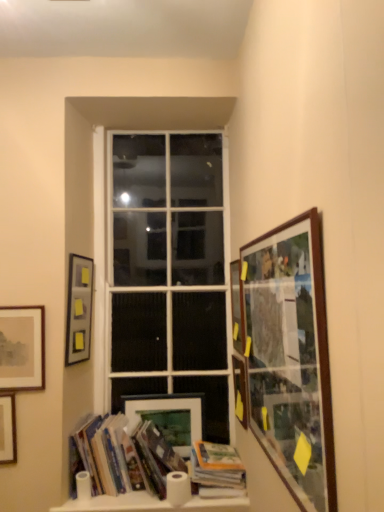
The height and width of the screenshot is (512, 384). What do you see at coordinates (140, 469) in the screenshot? I see `hardcover books at lower left, which is the first book from left to right` at bounding box center [140, 469].

This screenshot has width=384, height=512. What are the coordinates of `white glass window at center` in the screenshot? It's located at (166, 273).

This screenshot has width=384, height=512. Find the location of `white matte toilet paper at lower center, which ranks as the 1th toilet paper in right-to-left order`. white matte toilet paper at lower center, which ranks as the 1th toilet paper in right-to-left order is located at coordinates (178, 488).

Find the location of `matte black picture frame at lower left, acting as the third picture frame starting from the left`. matte black picture frame at lower left, acting as the third picture frame starting from the left is located at coordinates (79, 309).

Measure the distance between point (194, 477) and camera.

Point (194, 477) is 6.38 feet away from camera.

Find the location of `matte glass picture frame at right, marked as the sixth picture frame in a left-to-right arrangement`. matte glass picture frame at right, marked as the sixth picture frame in a left-to-right arrangement is located at coordinates (240, 389).

Is matte brown picture frame at left, which is counted as the 2th picture frame, starting from the left, oriented towards matte black picture frame at lower left, which ranks as the 5th picture frame in right-to-left order?

No, matte brown picture frame at left, which is counted as the 2th picture frame, starting from the left, does not turn towards matte black picture frame at lower left, which ranks as the 5th picture frame in right-to-left order.

Are matte brown picture frame at left, which is counted as the 2th picture frame, starting from the left, and matte black picture frame at lower left, which ranks as the 5th picture frame in right-to-left order, located far from each other?

No, matte brown picture frame at left, which is counted as the 2th picture frame, starting from the left, is in close proximity to matte black picture frame at lower left, which ranks as the 5th picture frame in right-to-left order.

Is matte brown picture frame at left, which is counted as the 2th picture frame, starting from the left, positioned beyond the bounds of matte black picture frame at lower left, which ranks as the 5th picture frame in right-to-left order?

Yes.

Who is smaller, matte brown picture frame at left, acting as the 6th picture frame starting from the right, or matte black picture frame at lower left, acting as the third picture frame starting from the left?

→ matte brown picture frame at left, acting as the 6th picture frame starting from the right.

Based on the photo, can you confirm if wooden picture frame at right, placed as the third picture frame when sorted from right to left, is taller than hardcover book at lower center, the 2th book when ordered from left to right?

Indeed, wooden picture frame at right, placed as the third picture frame when sorted from right to left, has a greater height compared to hardcover book at lower center, the 2th book when ordered from left to right.

Which point is more forward, (241, 352) or (209, 495)?

Point (241, 352)

Is wooden picture frame at right, the fifth picture frame positioned from the left, not inside hardcover book at lower center, the 2th book when ordered from left to right?

That's correct, wooden picture frame at right, the fifth picture frame positioned from the left, is outside of hardcover book at lower center, the 2th book when ordered from left to right.

Can you confirm if wooden picture frame at right, the fifth picture frame positioned from the left, is positioned to the left of hardcover book at lower center, the first book when ordered from right to left?

No, wooden picture frame at right, the fifth picture frame positioned from the left, is not to the left of hardcover book at lower center, the first book when ordered from right to left.

From a real-world perspective, is wooden picture frame at lower left, acting as the 7th picture frame starting from the right, physically located above or below matte black picture frame at lower left, which ranks as the 5th picture frame in right-to-left order?

In terms of real-world spatial position, wooden picture frame at lower left, acting as the 7th picture frame starting from the right, is below matte black picture frame at lower left, which ranks as the 5th picture frame in right-to-left order.

Consider the image. Could you tell me if wooden picture frame at lower left, acting as the 7th picture frame starting from the right, is facing matte black picture frame at lower left, which ranks as the 5th picture frame in right-to-left order?

No, wooden picture frame at lower left, acting as the 7th picture frame starting from the right, is not aimed at matte black picture frame at lower left, which ranks as the 5th picture frame in right-to-left order.

Does wooden picture frame at lower left, the 1th picture frame from the left, lie in front of matte black picture frame at lower left, which ranks as the 5th picture frame in right-to-left order?

Yes, it is in front of matte black picture frame at lower left, which ranks as the 5th picture frame in right-to-left order.

From the image's perspective, which one is positioned lower, wooden picture frame at lower left, acting as the 7th picture frame starting from the right, or matte black picture frame at lower left, acting as the third picture frame starting from the left?

From the image's view, wooden picture frame at lower left, acting as the 7th picture frame starting from the right, is below.

Are white matte toilet paper at lower center, which appears as the 2th toilet paper when viewed from the left, and wooden-framed collage at right, the 1th picture frame when ordered from right to left, far apart?

Yes.

Is white matte toilet paper at lower center, which ranks as the 1th toilet paper in right-to-left order, in front of or behind wooden-framed collage at right, the 1th picture frame when ordered from right to left, in the image?

Visually, white matte toilet paper at lower center, which ranks as the 1th toilet paper in right-to-left order, is located behind wooden-framed collage at right, the 1th picture frame when ordered from right to left.

Which is more to the left, white matte toilet paper at lower center, which ranks as the 1th toilet paper in right-to-left order, or wooden-framed collage at right, the 1th picture frame when ordered from right to left?

white matte toilet paper at lower center, which ranks as the 1th toilet paper in right-to-left order, is more to the left.

Can we say white matte toilet paper at lower center, which ranks as the 1th toilet paper in right-to-left order, lies outside wooden-framed collage at right, the 1th picture frame when ordered from right to left?

Yes, white matte toilet paper at lower center, which ranks as the 1th toilet paper in right-to-left order, is outside of wooden-framed collage at right, the 1th picture frame when ordered from right to left.

Is point (189, 397) in front of point (242, 419)?

No.

Is the position of matte wooden picture frame at lower center, acting as the 4th picture frame starting from the left, more distant than that of matte glass picture frame at right, acting as the second picture frame starting from the right?

Yes, it is.

Who is bigger, matte wooden picture frame at lower center, acting as the 4th picture frame starting from the left, or matte glass picture frame at right, acting as the second picture frame starting from the right?

Bigger between the two is matte wooden picture frame at lower center, acting as the 4th picture frame starting from the left.

Based on their positions, is white matte toilet paper at lower left, the second toilet paper when ordered from right to left, located to the left or right of matte glass picture frame at right, marked as the sixth picture frame in a left-to-right arrangement?

white matte toilet paper at lower left, the second toilet paper when ordered from right to left, is to the left of matte glass picture frame at right, marked as the sixth picture frame in a left-to-right arrangement.

Considering the positions of points (89, 485) and (239, 400), is point (89, 485) closer to camera compared to point (239, 400)?

That is False.

Considering their positions, is white matte toilet paper at lower left, which ranks as the 1th toilet paper in left-to-right order, located in front of or behind matte glass picture frame at right, acting as the second picture frame starting from the right?

In the image, white matte toilet paper at lower left, which ranks as the 1th toilet paper in left-to-right order, appears in front of matte glass picture frame at right, acting as the second picture frame starting from the right.

Considering the relative sizes of white matte toilet paper at lower left, the second toilet paper when ordered from right to left, and matte glass picture frame at right, acting as the second picture frame starting from the right, in the image provided, is white matte toilet paper at lower left, the second toilet paper when ordered from right to left, taller than matte glass picture frame at right, acting as the second picture frame starting from the right,?

No.

Considering the sizes of objects hardcover book at lower center, the first book when ordered from right to left, and white glass window at center in the image provided, who is thinner, hardcover book at lower center, the first book when ordered from right to left, or white glass window at center?

With smaller width is white glass window at center.

Is point (205, 478) positioned behind point (177, 142)?

No, it is not.

There is a white glass window at center. In order to click on the 2nd book below it (from a real-world perspective) in this screenshot , I will do `click(217, 470)`.

Locate an element on the screen. picture frame that is the 2nd one when counting upward from the matte brown picture frame at left, acting as the 6th picture frame starting from the right (from the image's perspective) is located at coordinates 79,309.

This screenshot has width=384, height=512. I want to click on picture frame that is the 1st object to the right of the hardcover book at lower center, the 2th book when ordered from left to right, starting at the anchor, so click(237, 307).

Estimate the real-world distances between objects in this image. Which object is closer to wooden-framed collage at right, the 1th picture frame when ordered from right to left, wooden picture frame at right, the fifth picture frame positioned from the left, or white matte toilet paper at lower left, the second toilet paper when ordered from right to left?

Based on the image, wooden picture frame at right, the fifth picture frame positioned from the left, appears to be nearer to wooden-framed collage at right, the 1th picture frame when ordered from right to left.

Estimate the real-world distances between objects in this image. Which object is closer to matte brown picture frame at left, acting as the 6th picture frame starting from the right, white matte toilet paper at lower left, which ranks as the 1th toilet paper in left-to-right order, or matte black picture frame at lower left, which ranks as the 5th picture frame in right-to-left order?

matte black picture frame at lower left, which ranks as the 5th picture frame in right-to-left order.

Based on their spatial positions, is matte black picture frame at lower left, which ranks as the 5th picture frame in right-to-left order, or matte glass picture frame at right, acting as the second picture frame starting from the right, closer to hardcover books at lower left, placed as the second book when sorted from right to left?

matte glass picture frame at right, acting as the second picture frame starting from the right, lies closer to hardcover books at lower left, placed as the second book when sorted from right to left, than the other object.

Based on their spatial positions, is wooden picture frame at lower left, acting as the 7th picture frame starting from the right, or matte brown picture frame at left, acting as the 6th picture frame starting from the right, further from matte glass picture frame at right, acting as the second picture frame starting from the right?

Based on the image, wooden picture frame at lower left, acting as the 7th picture frame starting from the right, appears to be further to matte glass picture frame at right, acting as the second picture frame starting from the right.

When comparing their distances from matte wooden picture frame at lower center, acting as the 4th picture frame starting from the right, does white matte toilet paper at lower center, which ranks as the 1th toilet paper in right-to-left order, or white matte toilet paper at lower left, the second toilet paper when ordered from right to left, seem closer?

white matte toilet paper at lower center, which ranks as the 1th toilet paper in right-to-left order.

Consider the image. Based on their spatial positions, is matte glass picture frame at right, marked as the sixth picture frame in a left-to-right arrangement, or matte brown picture frame at left, acting as the 6th picture frame starting from the right, closer to hardcover books at lower left, placed as the second book when sorted from right to left?

matte glass picture frame at right, marked as the sixth picture frame in a left-to-right arrangement, lies closer to hardcover books at lower left, placed as the second book when sorted from right to left, than the other object.

Estimate the real-world distances between objects in this image. Which object is closer to wooden picture frame at right, the fifth picture frame positioned from the left, white matte toilet paper at lower left, the second toilet paper when ordered from right to left, or white matte toilet paper at lower center, which appears as the 2th toilet paper when viewed from the left?

Based on the image, white matte toilet paper at lower center, which appears as the 2th toilet paper when viewed from the left, appears to be nearer to wooden picture frame at right, the fifth picture frame positioned from the left.

When comparing their distances from matte brown picture frame at left, acting as the 6th picture frame starting from the right, does matte black picture frame at lower left, acting as the third picture frame starting from the left, or hardcover book at lower center, the first book when ordered from right to left, seem closer?

matte black picture frame at lower left, acting as the third picture frame starting from the left.

This screenshot has width=384, height=512. Identify the location of window between matte black picture frame at lower left, acting as the third picture frame starting from the left, and wooden picture frame at right, placed as the third picture frame when sorted from right to left. (166, 273).

Locate an element on the screen. window between wooden picture frame at lower left, acting as the 7th picture frame starting from the right, and matte glass picture frame at right, acting as the second picture frame starting from the right, in the horizontal direction is located at coordinates (166, 273).

Locate an element on the screen. window situated between matte brown picture frame at left, acting as the 6th picture frame starting from the right, and hardcover book at lower center, the first book when ordered from right to left, from left to right is located at coordinates (166, 273).

The width and height of the screenshot is (384, 512). I want to click on toilet paper situated between white matte toilet paper at lower left, which ranks as the 1th toilet paper in left-to-right order, and hardcover book at lower center, the first book when ordered from right to left, from left to right, so click(178, 488).